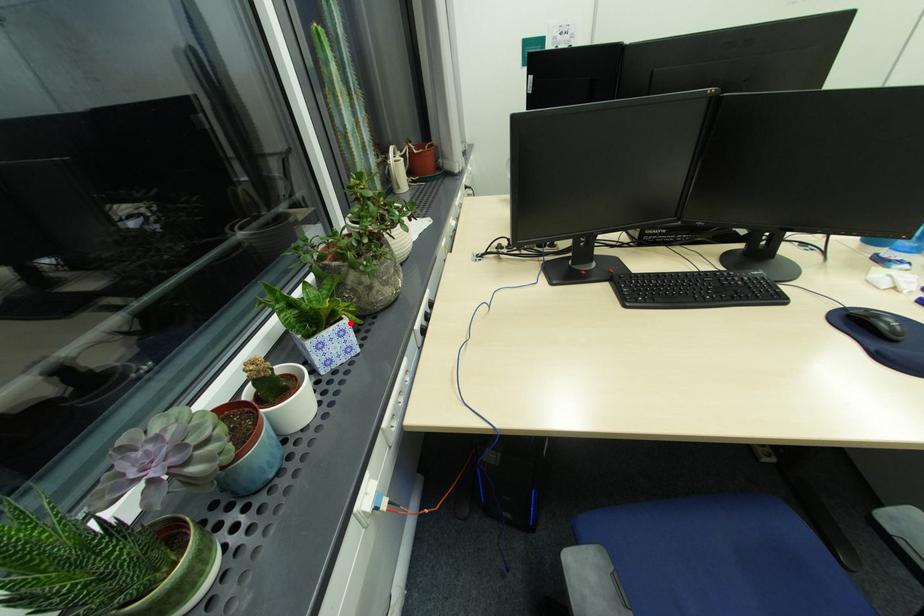
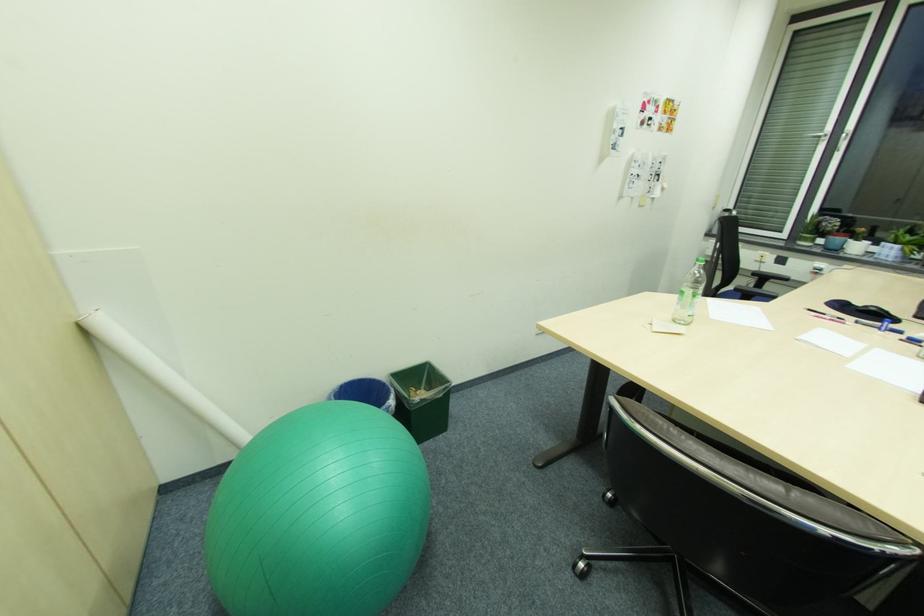
Question: I am providing you with two images of the same scene from different viewpoints. A red point is shown in image1. For the corresponding object point in image2, is it positioned nearer or farther from the camera?

Choices:
 (A) Nearer
 (B) Farther

Answer: (B)